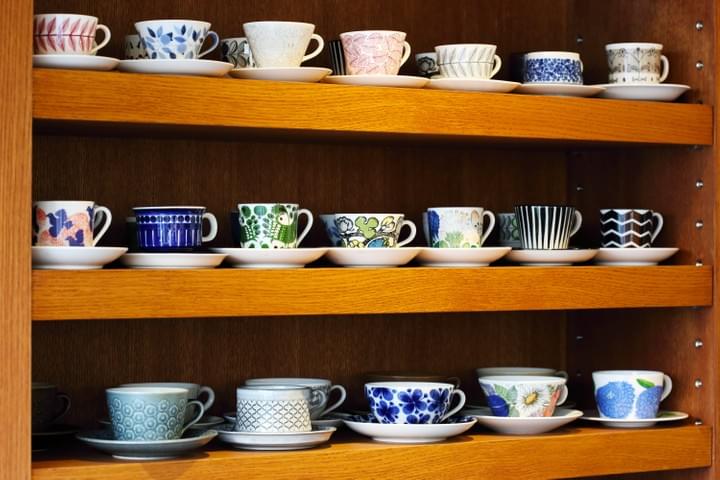
At what (x,y) coordinates should I click in order to perform the action: click on cups with floral designs. Please return your answer as a coordinate pair (x, y). Looking at the image, I should click on (515, 402), (415, 409), (368, 233), (451, 233), (60, 217), (171, 44), (63, 43).